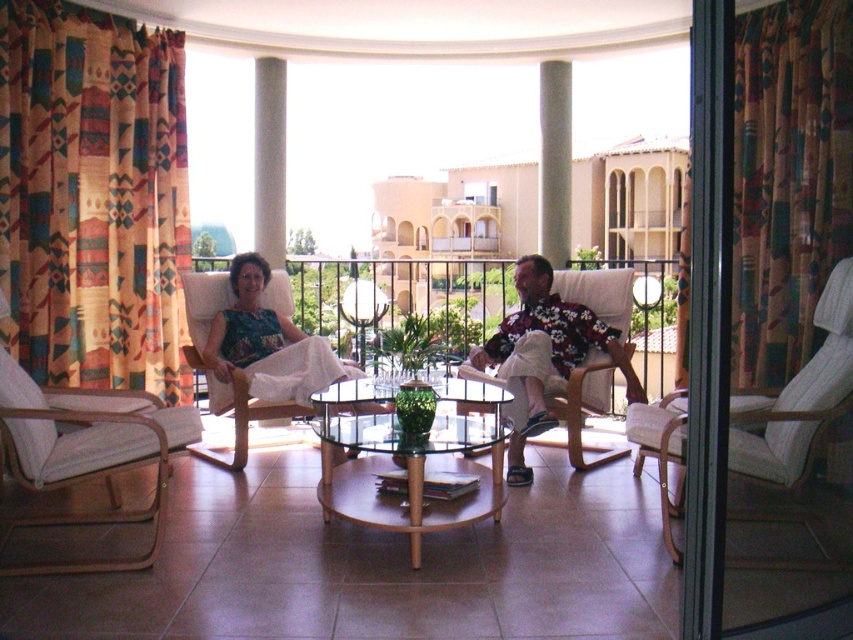
Does transparent glass door at right appear under matte floral shirt at center?

Actually, transparent glass door at right is above matte floral shirt at center.

Which is behind, point (711, 401) or point (572, 320)?

The point (572, 320) is more distant.

At what (x,y) coordinates should I click in order to perform the action: click on transparent glass door at right. Please return your answer as a coordinate pair (x, y). The width and height of the screenshot is (853, 640). Looking at the image, I should click on (718, 344).

Who is positioned more to the right, white fabric armchair at right or matte floral dress at center?

From the viewer's perspective, white fabric armchair at right appears more on the right side.

Which of these two, white fabric armchair at right or matte floral dress at center, stands shorter?

matte floral dress at center is shorter.

Is point (764, 426) farther from viewer compared to point (235, 259)?

That is False.

The width and height of the screenshot is (853, 640). In order to click on white fabric armchair at right in this screenshot , I will do `click(798, 397)`.

Who is more distant from viewer, (316,365) or (567,358)?

The point (567,358) is behind.

Does point (585, 326) come closer to viewer compared to point (560, 385)?

No, it is behind (560, 385).

Which is in front, point (514, 381) or point (500, 326)?

Point (514, 381) is more forward.

Where is `matte floral shirt at center`? Image resolution: width=853 pixels, height=640 pixels. matte floral shirt at center is located at coordinates (544, 355).